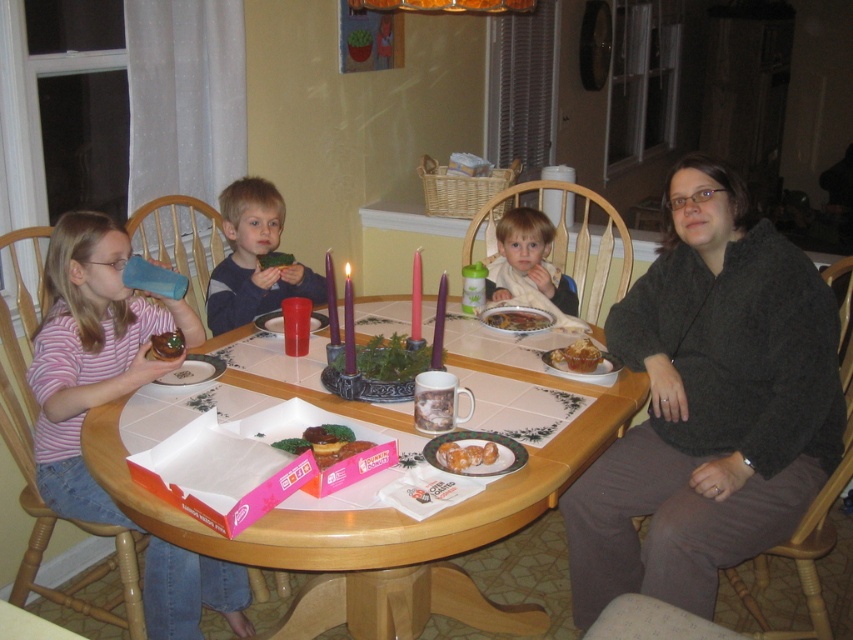
You are a guest at this dinner and need to find the striped cotton shirt at left. Where should you look relative to the dining table?

The striped cotton shirt at left is located at point 0.555 on the x axis and 0.108 on the y axis relative to the dining table.

You are planning to place a rectangular gift box that is 15 cm wide on the table. Considering the space occupied by the matte black sweater at upper right and the green leafy vegetable at center, which object should you avoid placing the gift box near to ensure it fits?

The matte black sweater at upper right has a larger width than the green leafy vegetable at center. Since the gift box is 15 cm wide, you should avoid placing it near the matte black sweater at upper right to ensure there is enough space.